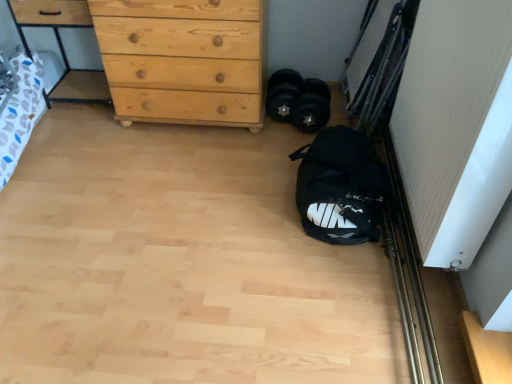
Where is `vacant space to the left of black fabric sack at lower right`? The width and height of the screenshot is (512, 384). vacant space to the left of black fabric sack at lower right is located at coordinates (233, 198).